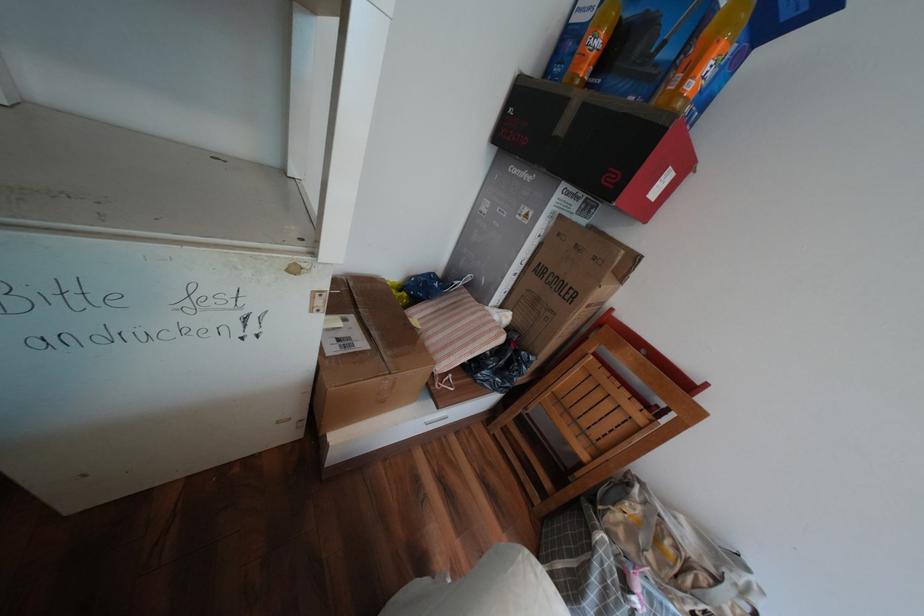
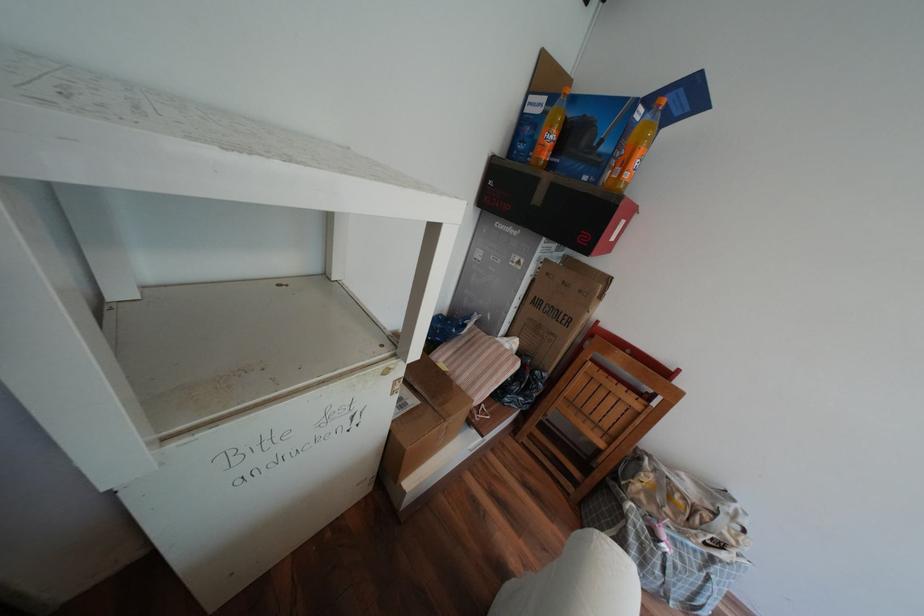
The point at (603, 257) is marked in the first image. Where is the corresponding point in the second image?

(590, 291)